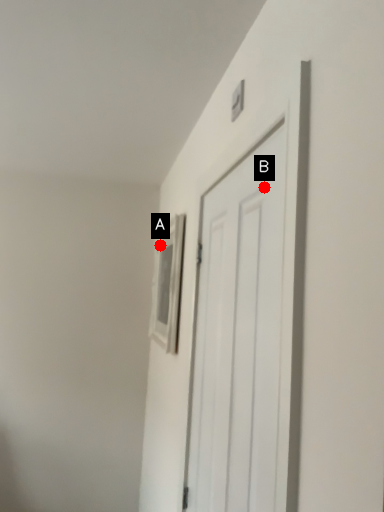
Question: Two points are circled on the image, labeled by A and B beside each circle. Which point is closer to the camera?

Choices:
 (A) A is closer
 (B) B is closer

Answer: (B)